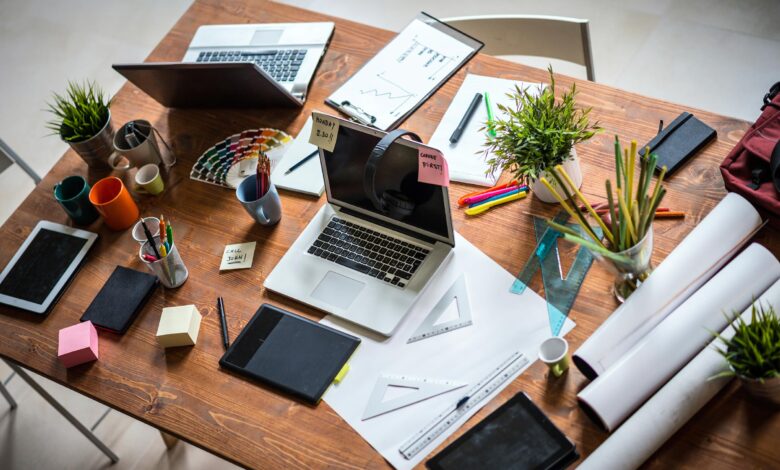
What are the coordinates of `pens, markers, pencils` in the screenshot? It's located at (161, 246), (225, 315), (257, 186), (502, 196), (465, 123), (300, 163), (679, 206).